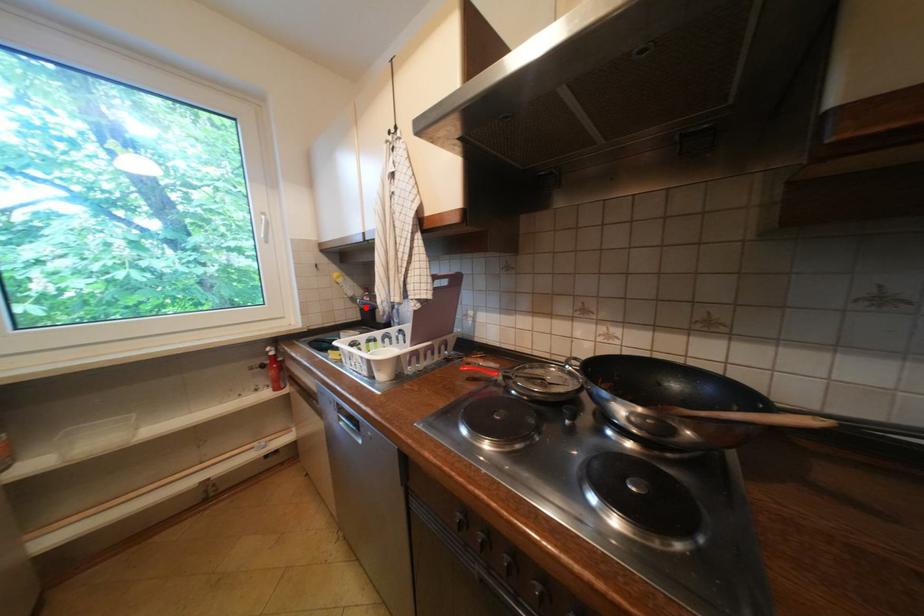
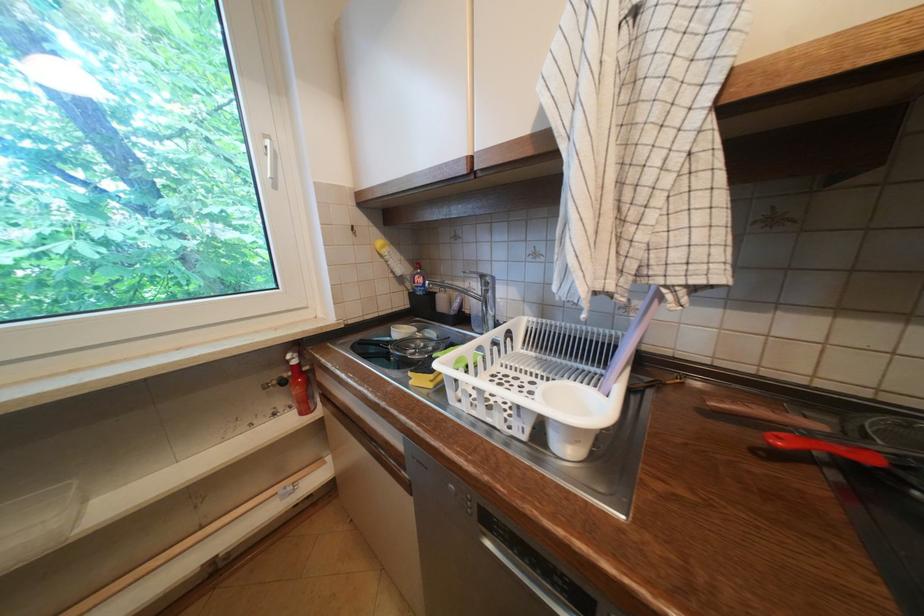
Question: I am providing you with two images of the same scene from different viewpoints. In image1, a red point is highlighted. Considering the same 3D point in image2, which of the following is correct?

Choices:
 (A) It is closer
 (B) It is farther

Answer: (A)